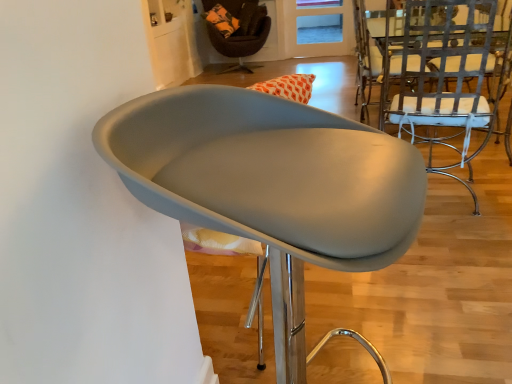
Question: Which direction should I rotate to face velvet brown armchair at upper center, marked as the 3th chair in a right-to-left arrangement, — up or down?

Choices:
 (A) down
 (B) up

Answer: (B)

Question: Which direction should I rotate to face matte gray chair at center, which is the 2th chair in left-to-right order, — up or down?

Choices:
 (A) down
 (B) up

Answer: (A)

Question: Considering the relative sizes of translucent orange glass door at upper center and metallic silver chair at right, which is counted as the 3th chair, starting from the left, in the image provided, is translucent orange glass door at upper center wider than metallic silver chair at right, which is counted as the 3th chair, starting from the left,?

Choices:
 (A) yes
 (B) no

Answer: (B)

Question: Is translucent orange glass door at upper center closer to the viewer compared to metallic silver chair at right, the second chair from the bottom?

Choices:
 (A) yes
 (B) no

Answer: (B)

Question: Is the position of translucent orange glass door at upper center more distant than that of metallic silver chair at right, marked as the 2th chair in a front-to-back arrangement?

Choices:
 (A) no
 (B) yes

Answer: (B)

Question: Considering the relative positions of translucent orange glass door at upper center and metallic silver chair at right, marked as the 2th chair in a front-to-back arrangement, in the image provided, is translucent orange glass door at upper center to the left of metallic silver chair at right, marked as the 2th chair in a front-to-back arrangement, from the viewer's perspective?

Choices:
 (A) yes
 (B) no

Answer: (B)

Question: From the image's perspective, is translucent orange glass door at upper center under metallic silver chair at right, marked as the 2th chair in a front-to-back arrangement?

Choices:
 (A) no
 (B) yes

Answer: (A)

Question: From a real-world perspective, is translucent orange glass door at upper center over metallic silver chair at right, which is counted as the 1th chair, starting from the right?

Choices:
 (A) yes
 (B) no

Answer: (B)

Question: Is metallic silver chair at right, which is counted as the 3th chair, starting from the left, touching matte gray chair at center, the first chair positioned from the front?

Choices:
 (A) yes
 (B) no

Answer: (B)

Question: Considering the relative sizes of metallic silver chair at right, which ranks as the 2th chair in back-to-front order, and matte gray chair at center, marked as the first chair in a bottom-to-top arrangement, in the image provided, is metallic silver chair at right, which ranks as the 2th chair in back-to-front order, smaller than matte gray chair at center, marked as the first chair in a bottom-to-top arrangement,?

Choices:
 (A) yes
 (B) no

Answer: (B)

Question: Can you confirm if metallic silver chair at right, which ranks as the 2th chair in back-to-front order, is positioned to the right of matte gray chair at center, positioned as the third chair in top-to-bottom order?

Choices:
 (A) no
 (B) yes

Answer: (B)

Question: Considering the relative positions of metallic silver chair at right, which ranks as the 2th chair in back-to-front order, and matte gray chair at center, the first chair positioned from the front, in the image provided, is metallic silver chair at right, which ranks as the 2th chair in back-to-front order, to the left of matte gray chair at center, the first chair positioned from the front, from the viewer's perspective?

Choices:
 (A) yes
 (B) no

Answer: (B)

Question: Does metallic silver chair at right, which is counted as the 3th chair, starting from the left, have a lesser height compared to matte gray chair at center, marked as the first chair in a bottom-to-top arrangement?

Choices:
 (A) yes
 (B) no

Answer: (B)

Question: Is metallic silver chair at right, the second chair from the bottom, further to camera compared to matte gray chair at center, the second chair viewed from the right?

Choices:
 (A) yes
 (B) no

Answer: (A)

Question: Is velvet brown armchair at upper center, positioned as the 1th chair in top-to-bottom order, smaller than matte gray chair at center, marked as the first chair in a bottom-to-top arrangement?

Choices:
 (A) yes
 (B) no

Answer: (B)